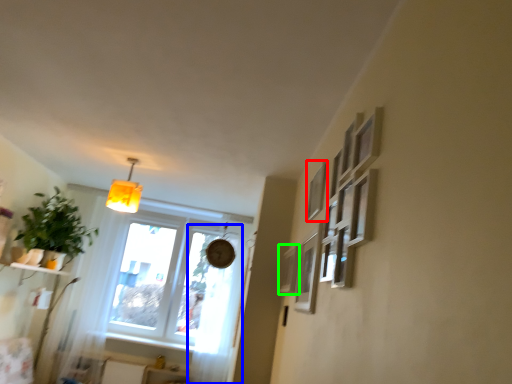
Question: Estimate the real-world distances between objects in this image. Which object is closer to picture frame (highlighted by a red box), curtain (highlighted by a blue box) or picture frame (highlighted by a green box)?

Choices:
 (A) curtain
 (B) picture frame

Answer: (B)